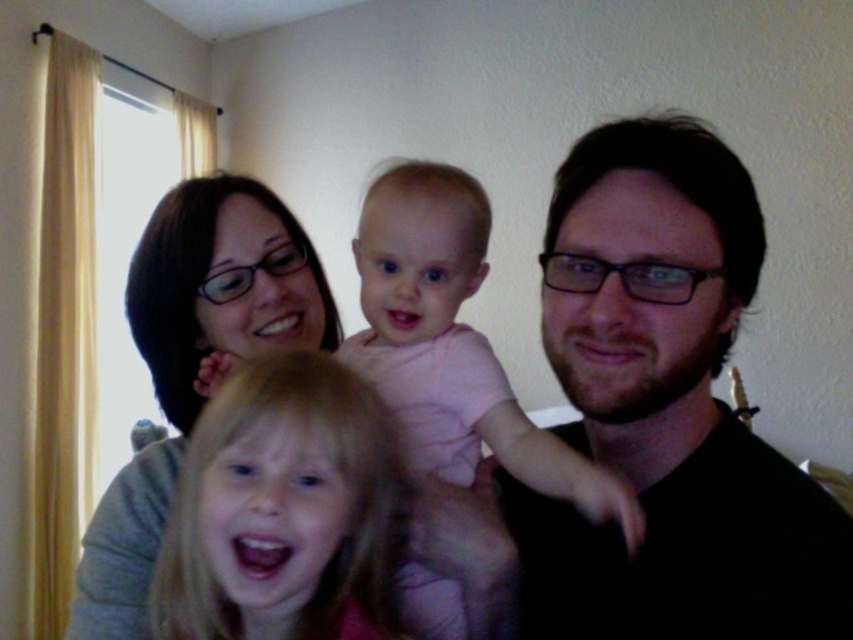
Is blonde hair at center positioned before pink fabric baby at center?

Yes, it is.

Does blonde hair at center have a lesser height compared to pink fabric baby at center?

Yes.

At what (x,y) coordinates should I click in order to perform the action: click on blonde hair at center. Please return your answer as a coordinate pair (x, y). Looking at the image, I should click on (282, 509).

Between matte gray sweater at upper left and pink fabric baby at center, which one appears on the right side from the viewer's perspective?

From the viewer's perspective, pink fabric baby at center appears more on the right side.

Does point (93, 515) come farther from viewer compared to point (396, 300)?

That is True.

I want to click on matte gray sweater at upper left, so click(x=194, y=362).

Does blonde hair at center have a larger size compared to matte gray sweater at upper left?

No.

Which of these two, blonde hair at center or matte gray sweater at upper left, stands shorter?

blonde hair at center is shorter.

Between point (358, 426) and point (322, 324), which one is positioned in front?

Positioned in front is point (358, 426).

Identify the location of blonde hair at center. The height and width of the screenshot is (640, 853). (282, 509).